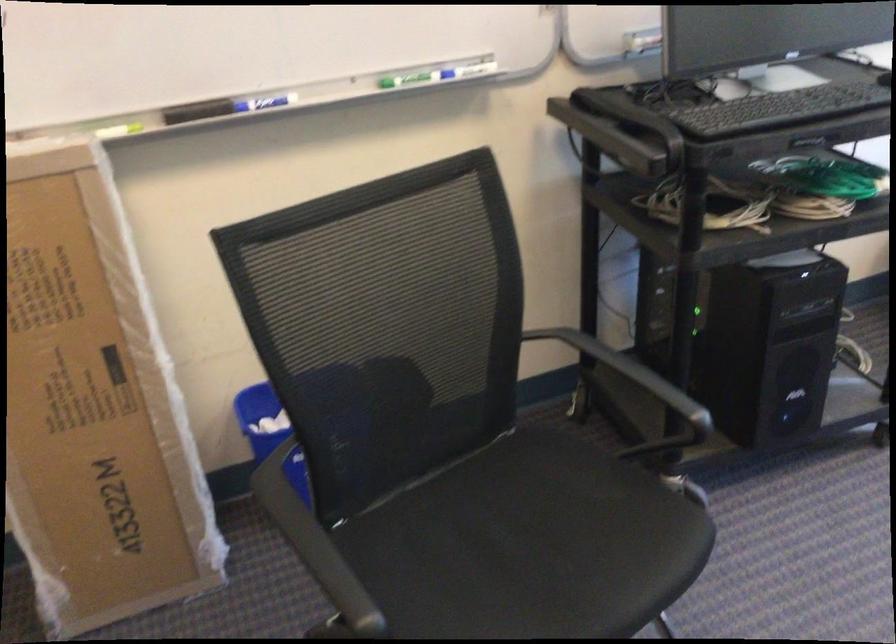
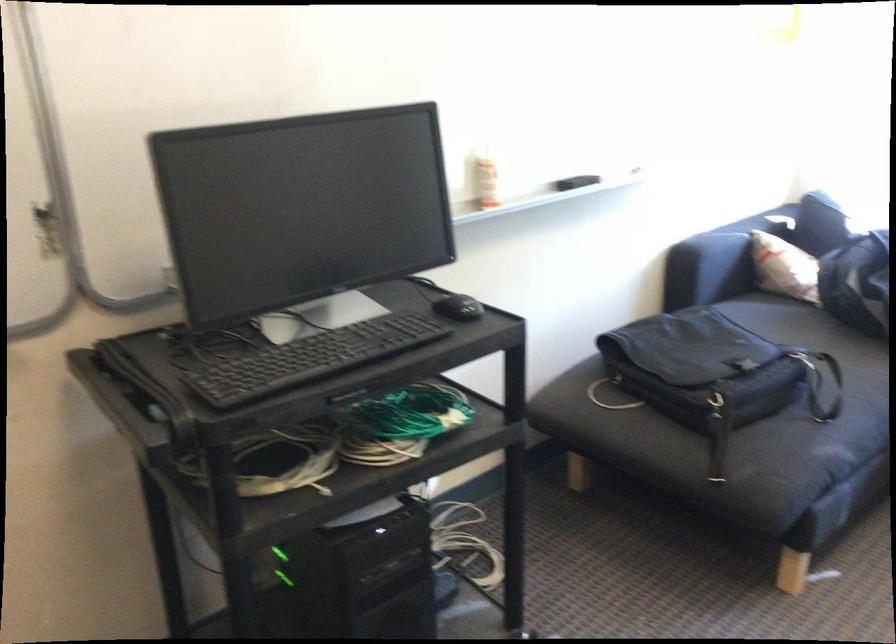
Which direction would the cameraman need to move to produce the second image?

The movement direction of the cameraman is right, forward.